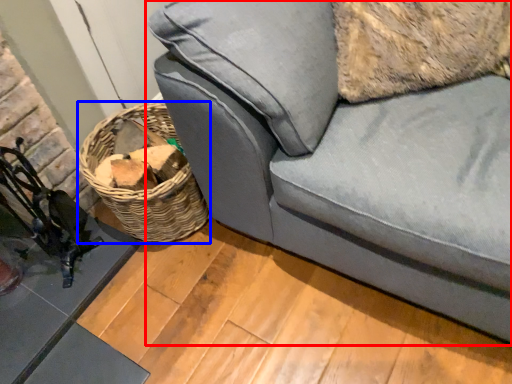
Question: Which object is closer to the camera taking this photo, studio couch (highlighted by a red box) or basket (highlighted by a blue box)?

Choices:
 (A) studio couch
 (B) basket

Answer: (A)